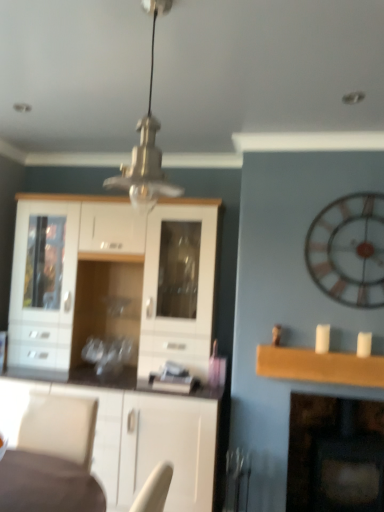
This screenshot has height=512, width=384. Find the location of `wooden clock at right`. wooden clock at right is located at coordinates (349, 250).

This screenshot has width=384, height=512. Describe the element at coordinates (349, 250) in the screenshot. I see `wooden clock at right` at that location.

What is the approximate height of white glossy cabinet at center?

The height of white glossy cabinet at center is 2.19 meters.

Locate an element on the screen. wooden clock at right is located at coordinates (349, 250).

Between wooden clock at right and white glossy cabinet at center, which one appears on the left side from the viewer's perspective?

From the viewer's perspective, white glossy cabinet at center appears more on the left side.

Is wooden clock at right positioned in front of white glossy cabinet at center?

Yes, wooden clock at right is closer to the camera.

Based on the photo, considering the sizes of objects wooden clock at right and white glossy cabinet at center in the image provided, who is bigger, wooden clock at right or white glossy cabinet at center?

white glossy cabinet at center.

Between wooden clock at right and dark brown wood fireplace at lower right, which one has more height?

With more height is dark brown wood fireplace at lower right.

Is wooden clock at right positioned before dark brown wood fireplace at lower right?

Yes.

Find the location of a particular element. fireplace that is on the right side of wooden clock at right is located at coordinates (335, 454).

Is wooden clock at right in contact with dark brown wood fireplace at lower right?

No, wooden clock at right is not next to dark brown wood fireplace at lower right.

From a real-world perspective, which is physically below, metallic glass pendant light at center or dark brown wood fireplace at lower right?

dark brown wood fireplace at lower right, from a real-world perspective.

How different are the orientations of metallic glass pendant light at center and dark brown wood fireplace at lower right in degrees?

The angle between the facing direction of metallic glass pendant light at center and the facing direction of dark brown wood fireplace at lower right is 177 degrees.

Considering the relative sizes of metallic glass pendant light at center and dark brown wood fireplace at lower right in the image provided, is metallic glass pendant light at center smaller than dark brown wood fireplace at lower right?

Indeed, metallic glass pendant light at center has a smaller size compared to dark brown wood fireplace at lower right.

Considering the relative sizes of wooden clock at right and metallic glass pendant light at center in the image provided, is wooden clock at right shorter than metallic glass pendant light at center?

Incorrect, the height of wooden clock at right does not fall short of that of metallic glass pendant light at center.

Is point (310, 269) farther from camera compared to point (156, 185)?

Yes, it is behind point (156, 185).

Considering the relative sizes of wooden clock at right and metallic glass pendant light at center in the image provided, is wooden clock at right wider than metallic glass pendant light at center?

Incorrect, the width of wooden clock at right does not surpass that of metallic glass pendant light at center.

Is wooden clock at right situated inside metallic glass pendant light at center or outside?

wooden clock at right cannot be found inside metallic glass pendant light at center.

Would you consider white glossy cabinet at center to be distant from wooden clock at right?

Indeed, white glossy cabinet at center is not near wooden clock at right.

Which of these two, white glossy cabinet at center or wooden clock at right, stands shorter?

Standing shorter between the two is wooden clock at right.

Is white glossy cabinet at center closer to camera compared to wooden clock at right?

No, the depth of white glossy cabinet at center is greater than that of wooden clock at right.

From the picture: Is wooden clock at right a part of white glossy cabinet at center?

Actually, wooden clock at right is outside white glossy cabinet at center.

Looking at this image, is white glossy cabinet at center at the right side of metallic glass pendant light at center?

In fact, white glossy cabinet at center is to the left of metallic glass pendant light at center.

From a real-world perspective, is white glossy cabinet at center under metallic glass pendant light at center?

Indeed, from a real-world perspective, white glossy cabinet at center is positioned beneath metallic glass pendant light at center.

Measure the distance from white glossy cabinet at center to metallic glass pendant light at center.

The distance of white glossy cabinet at center from metallic glass pendant light at center is 70.64 centimeters.

From the image's perspective, which is above, white glossy cabinet at center or metallic glass pendant light at center?

metallic glass pendant light at center is shown above in the image.

Considering the sizes of objects metallic glass pendant light at center and wooden clock at right in the image provided, who is bigger, metallic glass pendant light at center or wooden clock at right?

With larger size is metallic glass pendant light at center.

Is metallic glass pendant light at center aimed at wooden clock at right?

No, metallic glass pendant light at center is not turned towards wooden clock at right.

Does metallic glass pendant light at center have a greater height compared to wooden clock at right?

In fact, metallic glass pendant light at center may be shorter than wooden clock at right.

Does point (152, 129) come closer to viewer compared to point (380, 230)?

Yes, it is in front of point (380, 230).

Identify the location of clock above the white glossy cabinet at center (from the image's perspective). The width and height of the screenshot is (384, 512). (349, 250).

Locate an element on the screen. The height and width of the screenshot is (512, 384). clock that is in front of the dark brown wood fireplace at lower right is located at coordinates (349, 250).

Which object lies nearer to the anchor point dark brown wood fireplace at lower right, metallic glass pendant light at center or white glossy cabinet at center?

Based on the image, white glossy cabinet at center appears to be nearer to dark brown wood fireplace at lower right.

Estimate the real-world distances between objects in this image. Which object is further from dark brown wood fireplace at lower right, wooden clock at right or metallic glass pendant light at center?

metallic glass pendant light at center is further to dark brown wood fireplace at lower right.

Considering their positions, is wooden clock at right positioned closer to dark brown wood fireplace at lower right than white glossy cabinet at center?

Based on the image, wooden clock at right appears to be nearer to dark brown wood fireplace at lower right.

Which object lies further to the anchor point wooden clock at right, dark brown wood fireplace at lower right or white glossy cabinet at center?

The object further to wooden clock at right is white glossy cabinet at center.

Based on their spatial positions, is metallic glass pendant light at center or wooden clock at right further from dark brown wood fireplace at lower right?

metallic glass pendant light at center is positioned further to the anchor dark brown wood fireplace at lower right.

Considering their positions, is dark brown wood fireplace at lower right positioned further to white glossy cabinet at center than wooden clock at right?

Based on the image, dark brown wood fireplace at lower right appears to be further to white glossy cabinet at center.

Estimate the real-world distances between objects in this image. Which object is further from metallic glass pendant light at center, dark brown wood fireplace at lower right or wooden clock at right?

dark brown wood fireplace at lower right lies further to metallic glass pendant light at center than the other object.

Looking at the image, which one is located further to wooden clock at right, metallic glass pendant light at center or dark brown wood fireplace at lower right?

metallic glass pendant light at center.

What are the coordinates of `clock between metallic glass pendant light at center and dark brown wood fireplace at lower right from top to bottom` in the screenshot? It's located at (349, 250).

This screenshot has height=512, width=384. I want to click on cabinetry between metallic glass pendant light at center and dark brown wood fireplace at lower right from top to bottom, so click(x=119, y=283).

This screenshot has width=384, height=512. Find the location of `light fixture situated between white glossy cabinet at center and wooden clock at right from left to right`. light fixture situated between white glossy cabinet at center and wooden clock at right from left to right is located at coordinates (146, 146).

At what (x,y) coordinates should I click in order to perform the action: click on clock between white glossy cabinet at center and dark brown wood fireplace at lower right. Please return your answer as a coordinate pair (x, y). Looking at the image, I should click on (349, 250).